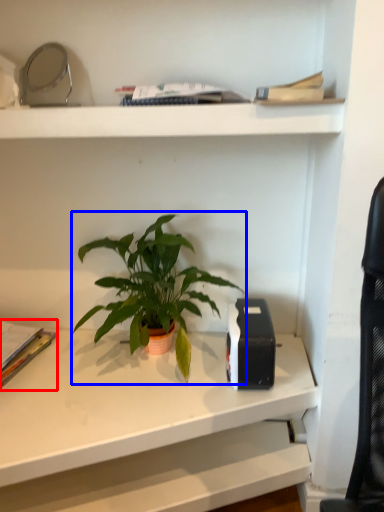
Question: Which of the following is the closest to the observer, paperback book (highlighted by a red box) or houseplant (highlighted by a blue box)?

Choices:
 (A) paperback book
 (B) houseplant

Answer: (B)